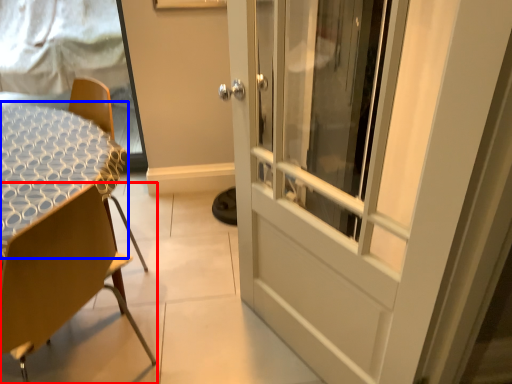
Question: Which point is closer to the camera, chair (highlighted by a red box) or round table (highlighted by a blue box)?

Choices:
 (A) chair
 (B) round table

Answer: (A)